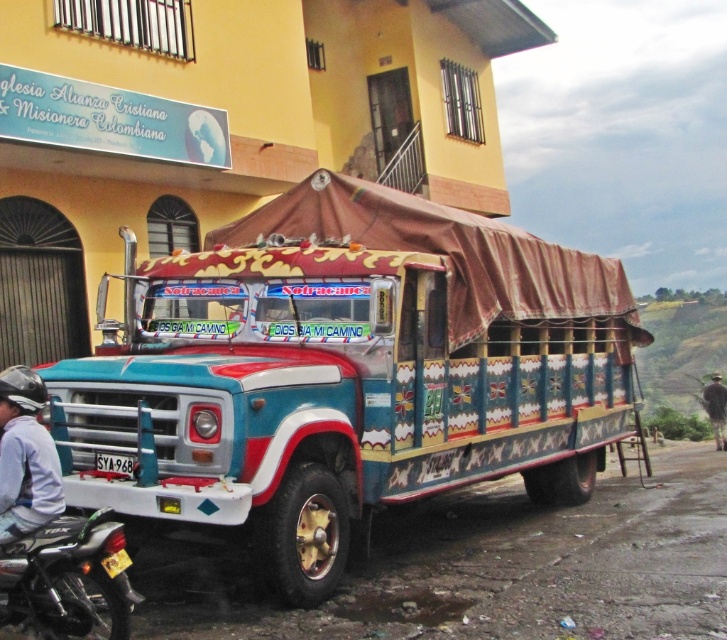
Between shiny black motorcycle at lower left and brown fabric person at lower right, which one is positioned lower?

Positioned lower is brown fabric person at lower right.

Who is more distant from viewer, (12,560) or (720,394)?

The point (720,394) is behind.

The image size is (727, 640). In order to click on shiny black motorcycle at lower left in this screenshot , I will do `click(68, 579)`.

Who is shorter, painted wood bus at center or brushed metal helmet at left?

Standing shorter between the two is painted wood bus at center.

You are a GUI agent. You are given a task and a screenshot of the screen. Output one action in this format:
    pyautogui.click(x=<x>, y=<y>)
    Task: Click on the painted wood bus at center
    The image size is (727, 640).
    Given the screenshot: What is the action you would take?
    pyautogui.click(x=345, y=372)

Is point (553, 426) farther from viewer compared to point (9, 406)?

Yes, point (553, 426) is farther from viewer.

Where is `painted wood bus at center`? This screenshot has height=640, width=727. painted wood bus at center is located at coordinates (345, 372).

Measure the distance between painted wood bus at center and brown fabric person at lower right.

They are 69.17 feet apart.

Is painted wood bus at center thinner than brown fabric person at lower right?

Correct, painted wood bus at center's width is less than brown fabric person at lower right's.

Locate an element on the screen. The height and width of the screenshot is (640, 727). painted wood bus at center is located at coordinates (345, 372).